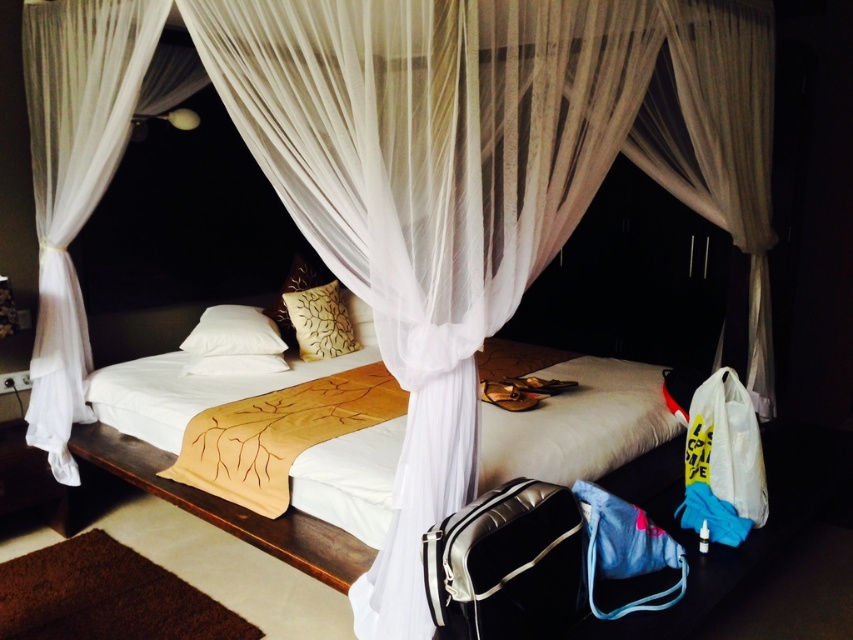
You are standing in the bedroom and want to place a 2.0 meter long ladder against the wall behind the white fabric bed at center. Is there enough space between you and the bed to safely maneuver the ladder?

The distance between you and the white fabric bed at center is 1.99 meters. Since the ladder is 2.0 meters long, there is not enough space to safely maneuver it between you and the bed.